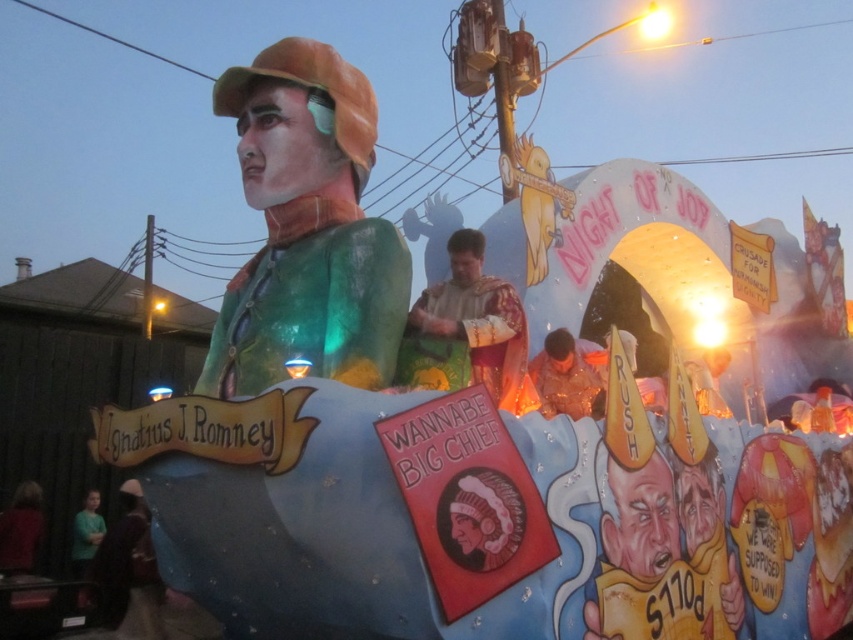
Between green translucent figure at center and golden fabric robe at center, which one is positioned higher?

green translucent figure at center is higher up.

Which is more to the right, green translucent figure at center or golden fabric robe at center?

Positioned to the right is golden fabric robe at center.

The width and height of the screenshot is (853, 640). I want to click on green translucent figure at center, so click(306, 228).

Is point (398, 280) closer to viewer compared to point (573, 401)?

Yes, point (398, 280) is closer to viewer.

Does green translucent figure at center have a lesser width compared to shiny gold star at center?

No, green translucent figure at center is not thinner than shiny gold star at center.

Locate an element on the screen. Image resolution: width=853 pixels, height=640 pixels. green translucent figure at center is located at coordinates (306, 228).

Who is positioned more to the left, golden fabric robe at center or shiny gold star at center?

golden fabric robe at center is more to the left.

Measure the distance between golden fabric robe at center and camera.

golden fabric robe at center and camera are 145.84 feet apart from each other.

Does point (454, 262) come closer to viewer compared to point (575, 378)?

Yes, point (454, 262) is in front of point (575, 378).

Identify the location of golden fabric robe at center. (480, 323).